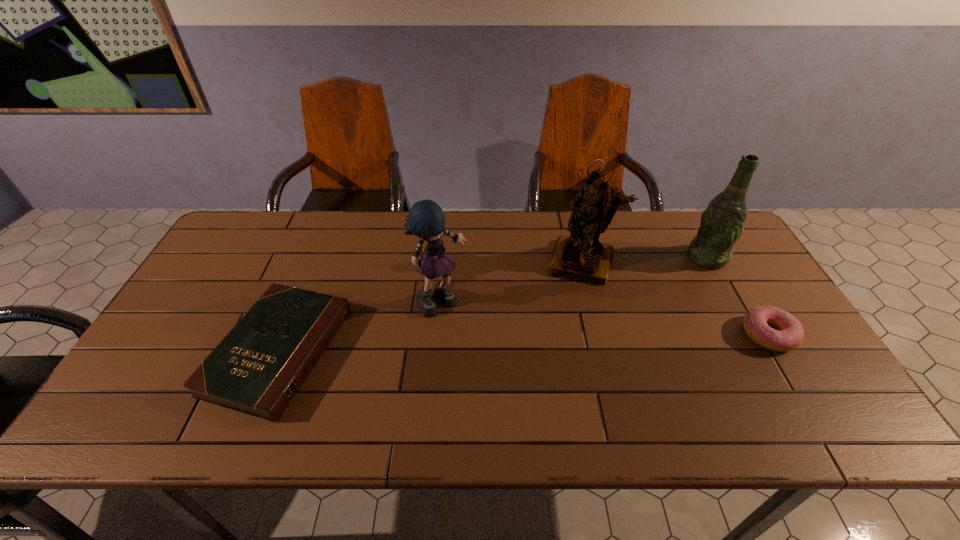
At what (x,y) coordinates should I click in order to perform the action: click on free space on the desktop that is between the leftmost object and the doughnut and is positioned on the surface of the beer bottle. Please return your answer as a coordinate pair (x, y). Looking at the image, I should click on (594, 341).

Find the location of a particular element. The image size is (960, 540). free space on the desktop that is between the leftmost object and the doughnut and is positioned on the front-facing side of the second object from left to right is located at coordinates (495, 344).

This screenshot has width=960, height=540. I want to click on vacant space on the desktop that is between the leftmost object and the doughnut and is positioned on the front-facing side of the third object from left to right, so click(x=558, y=342).